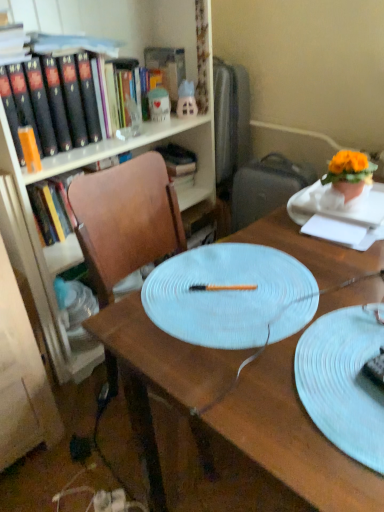
The width and height of the screenshot is (384, 512). I want to click on blank space to the left of chocolate cake at center, so click(312, 406).